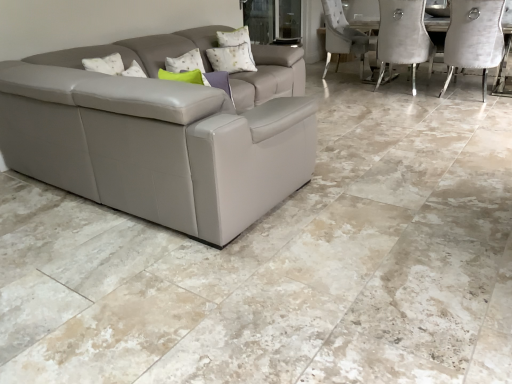
Where is `vacant area to the left of velvet grey chair at upper right`? The height and width of the screenshot is (384, 512). vacant area to the left of velvet grey chair at upper right is located at coordinates (414, 99).